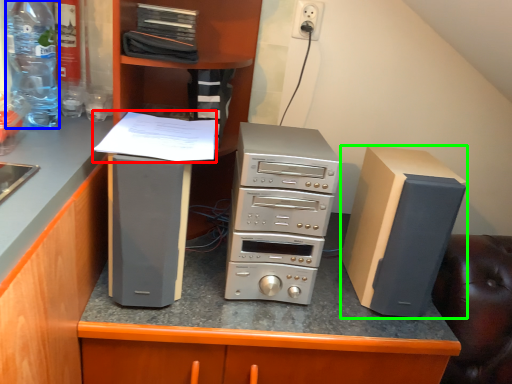
Question: Which object is the farthest from paper (highlighted by a red box)? Choose among these: bottle (highlighted by a blue box) or computer tower (highlighted by a green box).

Choices:
 (A) bottle
 (B) computer tower

Answer: (B)